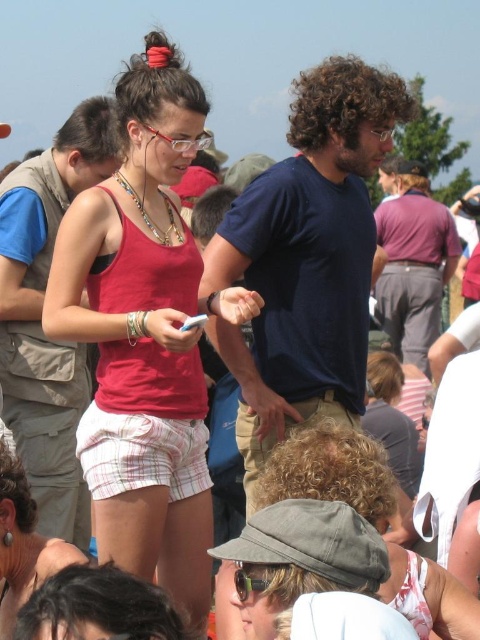
Question: Does dark blue t-shirt at center lie in front of matte pink shorts at center?

Choices:
 (A) yes
 (B) no

Answer: (B)

Question: Which point is farther to the camera?

Choices:
 (A) (36, 534)
 (B) (182, 422)
 (C) (336, 84)

Answer: (C)

Question: Which object is farther from the camera taking this photo?

Choices:
 (A) dark blue t-shirt at center
 (B) matte blue shirt at center

Answer: (A)

Question: Which point appears farthest from the camera in this image?

Choices:
 (A) (220, 285)
 (B) (36, 554)

Answer: (A)

Question: Does matte blue shirt at center appear on the right side of purple cotton shirt at center?

Choices:
 (A) yes
 (B) no

Answer: (B)

Question: From the image, what is the correct spatial relationship of matte blue shirt at center in relation to matte pink shorts at center?

Choices:
 (A) right
 (B) left

Answer: (B)